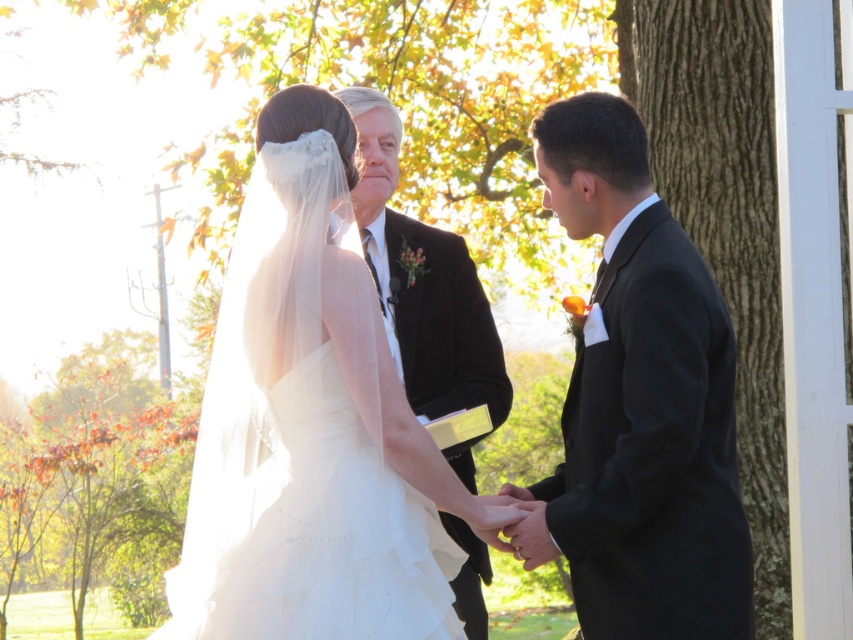
Question: Which of the following is the closest to the observer?

Choices:
 (A) white satin dress at center
 (B) reddish-brown leaves at left

Answer: (A)

Question: Which point is farther to the camera?

Choices:
 (A) (67, 465)
 (B) (357, 442)
 (C) (759, 547)
 (D) (439, 580)

Answer: (A)

Question: Where is white satin dress at center located in relation to reddish-brown leaves at left in the image?

Choices:
 (A) left
 (B) right

Answer: (B)

Question: Is matte black suit at right wider than smooth bark tree at right?

Choices:
 (A) no
 (B) yes

Answer: (B)

Question: Can you confirm if white satin dress at center is positioned to the right of smooth bark tree at right?

Choices:
 (A) yes
 (B) no

Answer: (B)

Question: Which point is farther to the camera?

Choices:
 (A) (405, 554)
 (B) (171, 403)
 (C) (573, 452)
 (D) (354, 486)

Answer: (B)